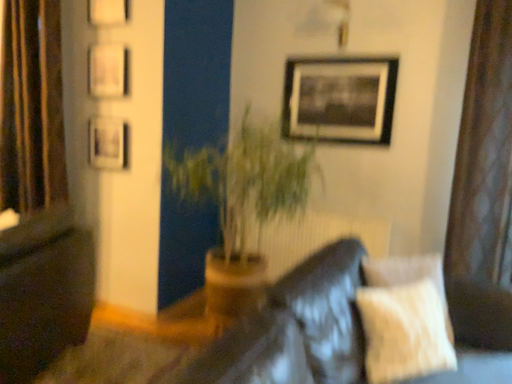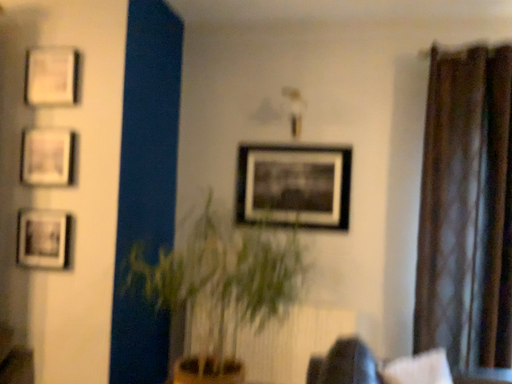
Question: Which way did the camera rotate in the video?

Choices:
 (A) rotated upward
 (B) rotated downward

Answer: (A)